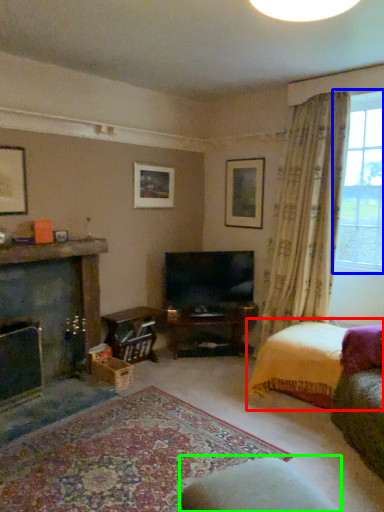
Question: Considering the real-world distances, which object is closest to bed (highlighted by a red box)? window (highlighted by a blue box) or rocking chair (highlighted by a green box).

Choices:
 (A) window
 (B) rocking chair

Answer: (A)